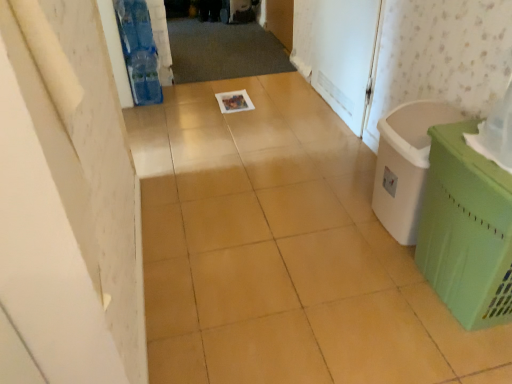
This screenshot has height=384, width=512. I want to click on free space above green plastic laundry basket at right (from a real-world perspective), so click(x=424, y=119).